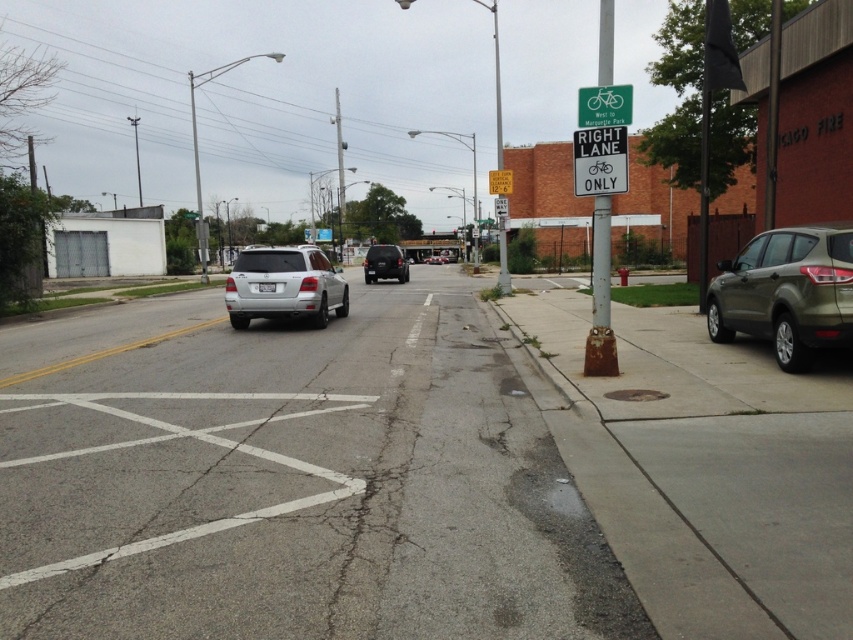
You are a delivery driver in a vehicle that is 2.5 meters wide. You need to drive through a section of the road where there is a matte olive suv at right and a green plastic sign at upper center. Can your vehicle pass safely between them?

The matte olive suv at right is narrower than the green plastic sign at upper center, but since your vehicle is 2.5 meters wide, you need to ensure there is enough space between them. However, the exact distance between the two objects isn